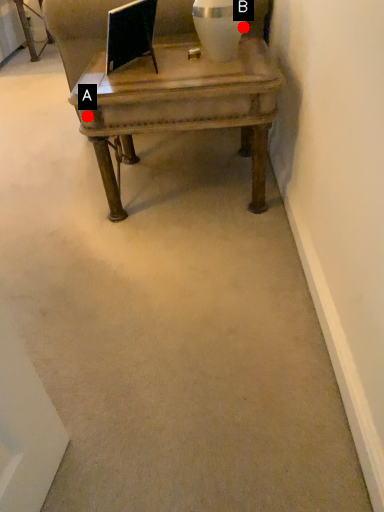
Question: Two points are circled on the image, labeled by A and B beside each circle. Which point is closer to the camera taking this photo?

Choices:
 (A) A is closer
 (B) B is closer

Answer: (A)